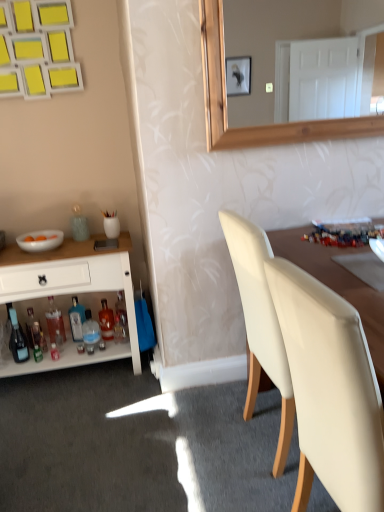
Question: Considering the relative sizes of translucent glass bottle at lower left, the 6th bottle positioned from the left, and white glossy cabinet at left in the image provided, is translucent glass bottle at lower left, the 6th bottle positioned from the left, taller than white glossy cabinet at left?

Choices:
 (A) yes
 (B) no

Answer: (B)

Question: Is translucent glass bottle at lower left, placed as the second bottle when sorted from right to left, turned away from white glossy cabinet at left?

Choices:
 (A) no
 (B) yes

Answer: (B)

Question: From a real-world perspective, is translucent glass bottle at lower left, placed as the second bottle when sorted from right to left, on top of white glossy cabinet at left?

Choices:
 (A) no
 (B) yes

Answer: (A)

Question: Does translucent glass bottle at lower left, the 6th bottle positioned from the left, have a lesser height compared to white glossy cabinet at left?

Choices:
 (A) yes
 (B) no

Answer: (A)

Question: Does translucent glass bottle at lower left, the 6th bottle positioned from the left, have a lesser width compared to white glossy cabinet at left?

Choices:
 (A) yes
 (B) no

Answer: (A)

Question: Is white glossy bowl at left inside the boundaries of translucent glass bottle at lower left, positioned as the sixth bottle in right-to-left order, or outside?

Choices:
 (A) outside
 (B) inside

Answer: (A)

Question: In the image, is white glossy bowl at left on the left side or the right side of translucent glass bottle at lower left, the 2th bottle from the left?

Choices:
 (A) left
 (B) right

Answer: (B)

Question: Considering their positions, is white glossy bowl at left located in front of or behind translucent glass bottle at lower left, the 2th bottle from the left?

Choices:
 (A) front
 (B) behind

Answer: (A)

Question: Is point (49, 237) closer or farther from the camera than point (29, 331)?

Choices:
 (A) closer
 (B) farther

Answer: (A)

Question: Considering the positions of translucent glass bottle at lower left, the 2th bottle from the left, and white glossy cabinet at left in the image, is translucent glass bottle at lower left, the 2th bottle from the left, wider or thinner than white glossy cabinet at left?

Choices:
 (A) wide
 (B) thin

Answer: (B)

Question: Is translucent glass bottle at lower left, the 2th bottle from the left, situated inside white glossy cabinet at left or outside?

Choices:
 (A) inside
 (B) outside

Answer: (A)

Question: From a real-world perspective, is translucent glass bottle at lower left, the 2th bottle from the left, above or below white glossy cabinet at left?

Choices:
 (A) below
 (B) above

Answer: (A)

Question: Is point [33, 340] positioned closer to the camera than point [41, 258]?

Choices:
 (A) closer
 (B) farther

Answer: (B)

Question: Considering the positions of white matte chair at right and translucent glass bottle at lower left, which is the 1th bottle from right to left, in the image, is white matte chair at right wider or thinner than translucent glass bottle at lower left, which is the 1th bottle from right to left,?

Choices:
 (A) thin
 (B) wide

Answer: (B)

Question: Is white matte chair at right inside or outside of translucent glass bottle at lower left, which is the 1th bottle from right to left?

Choices:
 (A) inside
 (B) outside

Answer: (B)